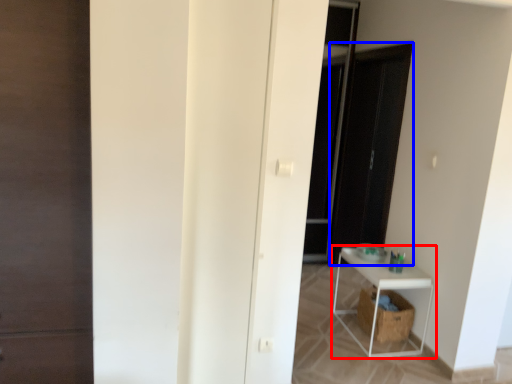
Question: Which object is further to the camera taking this photo, shelf (highlighted by a red box) or screen door (highlighted by a blue box)?

Choices:
 (A) shelf
 (B) screen door

Answer: (B)